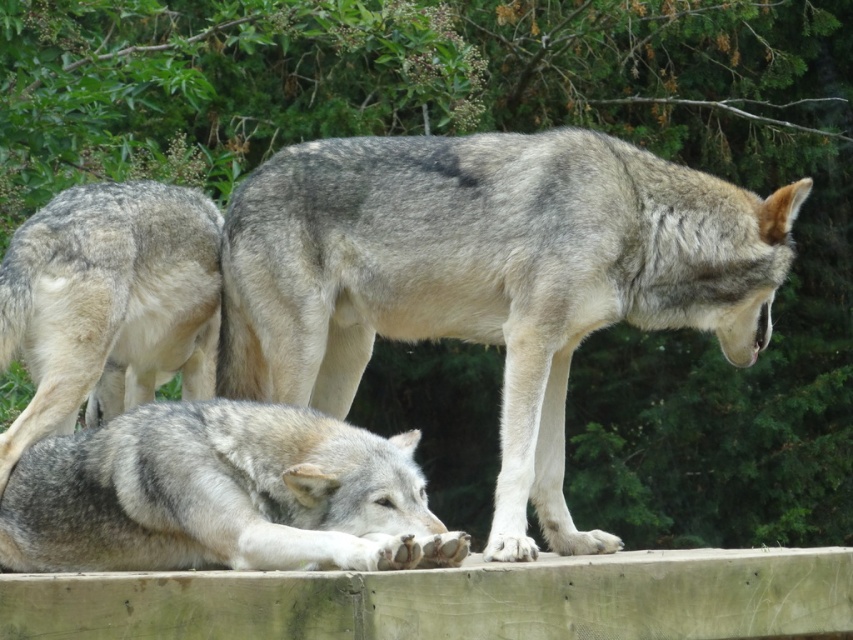
Is point (225, 483) in front of point (62, 252)?

Yes, it is.

Is point (131, 522) in front of point (102, 273)?

Yes, point (131, 522) is in front of point (102, 273).

The height and width of the screenshot is (640, 853). Find the location of `gray fur wolf at lower left`. gray fur wolf at lower left is located at coordinates (221, 493).

Based on the photo, is gray fur wolf at center further to the viewer compared to gray fur wolf at lower left?

Yes, gray fur wolf at center is further from the viewer.

Does gray fur wolf at center appear on the right side of gray fur wolf at lower left?

Yes, gray fur wolf at center is to the right of gray fur wolf at lower left.

Locate an element on the screen. The height and width of the screenshot is (640, 853). gray fur wolf at center is located at coordinates (488, 276).

Is point (537, 250) more distant than point (167, 243)?

No.

Is point (502, 236) closer to camera compared to point (175, 256)?

Yes, it is.

Where is `gray fur wolf at center`? Image resolution: width=853 pixels, height=640 pixels. gray fur wolf at center is located at coordinates (488, 276).